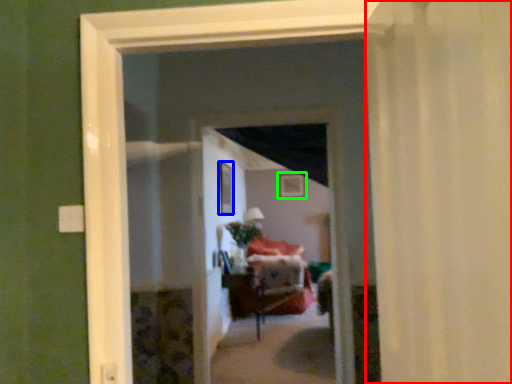
Question: Based on their relative distances, which object is farther from curtain (highlighted by a red box)? Choose from window (highlighted by a blue box) and picture frame (highlighted by a green box).

Choices:
 (A) window
 (B) picture frame

Answer: (B)